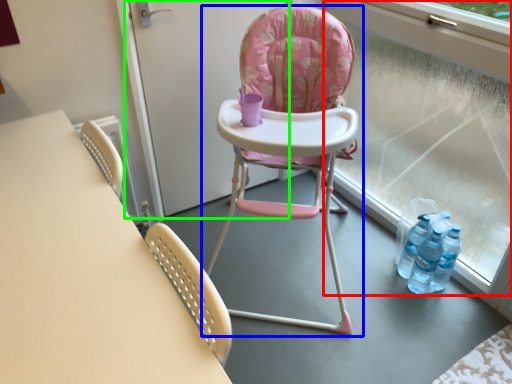
Question: Estimate the real-world distances between objects in this image. Which object is farther from window frame (highlighted by a red box), chair (highlighted by a blue box) or screen door (highlighted by a green box)?

Choices:
 (A) chair
 (B) screen door

Answer: (B)